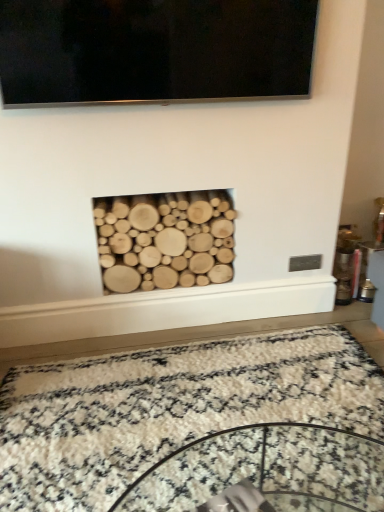
Question: Does white shaggy rug at center come behind black glossy flat-screen tv at upper center?

Choices:
 (A) yes
 (B) no

Answer: (B)

Question: Does white shaggy rug at center appear on the right side of black glossy flat-screen tv at upper center?

Choices:
 (A) no
 (B) yes

Answer: (B)

Question: From the image's perspective, is white shaggy rug at center on top of black glossy flat-screen tv at upper center?

Choices:
 (A) yes
 (B) no

Answer: (B)

Question: Is the depth of white shaggy rug at center less than that of black glossy flat-screen tv at upper center?

Choices:
 (A) no
 (B) yes

Answer: (B)

Question: Is white shaggy rug at center taller than black glossy flat-screen tv at upper center?

Choices:
 (A) yes
 (B) no

Answer: (B)

Question: Does point (221, 253) appear closer or farther from the camera than point (66, 468)?

Choices:
 (A) farther
 (B) closer

Answer: (A)

Question: Based on their sizes in the image, would you say natural wood logs at center is bigger or smaller than white shaggy rug at center?

Choices:
 (A) big
 (B) small

Answer: (B)

Question: From a real-world perspective, is natural wood logs at center above or below white shaggy rug at center?

Choices:
 (A) above
 (B) below

Answer: (A)

Question: Is natural wood logs at center taller or shorter than white shaggy rug at center?

Choices:
 (A) short
 (B) tall

Answer: (B)

Question: Do you think white shaggy rug at center is within natural wood logs at center, or outside of it?

Choices:
 (A) outside
 (B) inside

Answer: (A)

Question: From a real-world perspective, is white shaggy rug at center positioned above or below natural wood logs at center?

Choices:
 (A) above
 (B) below

Answer: (B)

Question: Is point (34, 406) positioned closer to the camera than point (220, 189)?

Choices:
 (A) closer
 (B) farther

Answer: (A)

Question: Relative to natural wood logs at center, is white shaggy rug at center in front or behind?

Choices:
 (A) front
 (B) behind

Answer: (A)

Question: Is natural wood logs at center situated inside black glossy flat-screen tv at upper center or outside?

Choices:
 (A) outside
 (B) inside

Answer: (A)

Question: In the image, is natural wood logs at center positioned in front of or behind black glossy flat-screen tv at upper center?

Choices:
 (A) front
 (B) behind

Answer: (B)